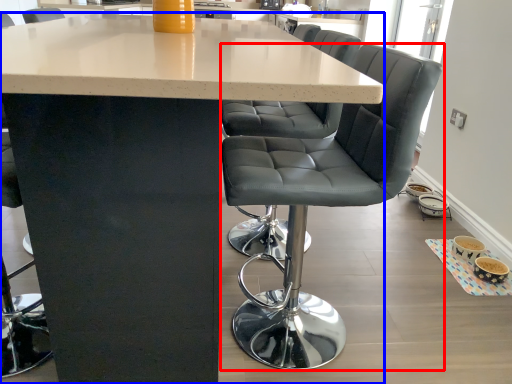
Question: Which object is further to the camera taking this photo, chair (highlighted by a red box) or table (highlighted by a blue box)?

Choices:
 (A) chair
 (B) table

Answer: (A)